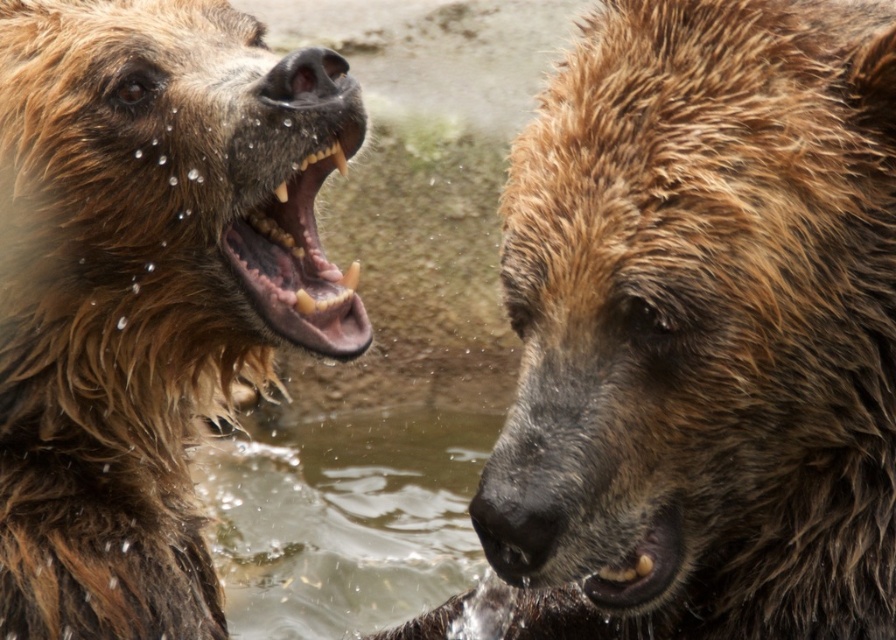
You are a wildlife photographer holding a camera with a 1.5 meter focal length. You want to capture a closeup of the wet fur bear at center. Is your camera capable of focusing on the bear from your current position?

The distance between the wet fur bear at center and the camera is 1.49 meters, which is slightly less than the 1.5 meter focal length. Therefore, the camera can focus on the bear from your current position.

You are a wildlife photographer observing two bears in a river. You have a camera with a zoom lens. The wet fur bear at center is closer to you than the brown fur mouth at left. Which bear should you zoom in on to capture the most detailed shot of their fur texture?

The wet fur bear at center is closer to you and has a larger size compared to the brown fur mouth at left, so zooming in on the wet fur bear at center will provide a clearer view of its fur texture.